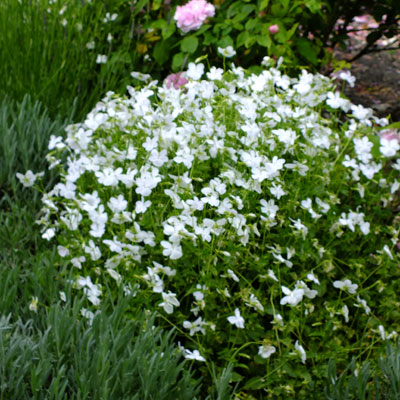
Locate an element on the screen. This screenshot has width=400, height=400. green plants is located at coordinates (101, 355), (20, 127), (34, 47), (380, 362).